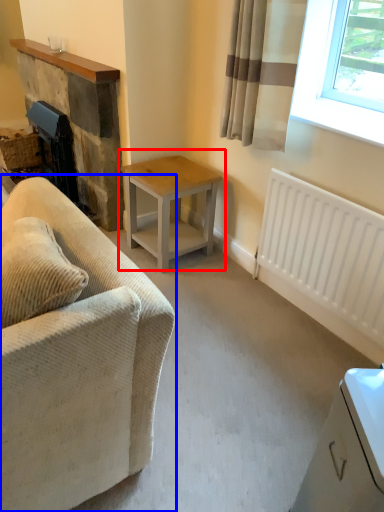
Question: Which point is closer to the camera, table (highlighted by a red box) or studio couch (highlighted by a blue box)?

Choices:
 (A) table
 (B) studio couch

Answer: (B)